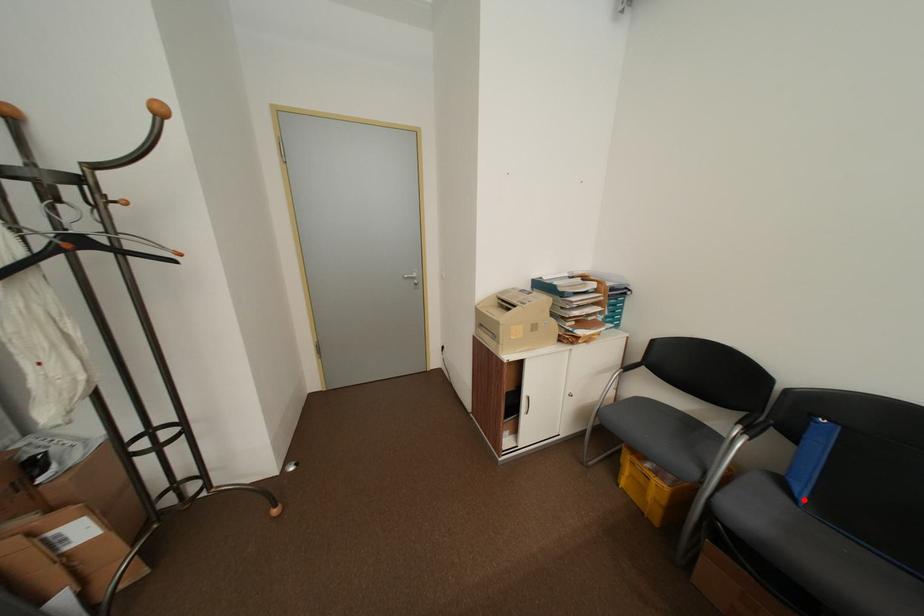
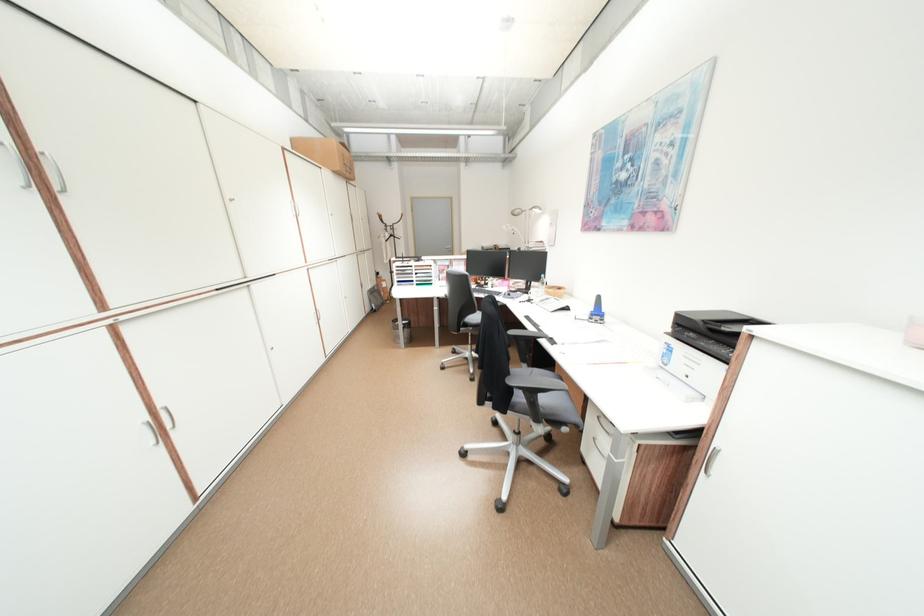
Question: I am providing you with two images of the same scene from different viewpoints. A red point is marked on the first image. Can you still see the location of the red point in image 2?

Choices:
 (A) Yes
 (B) No

Answer: (B)